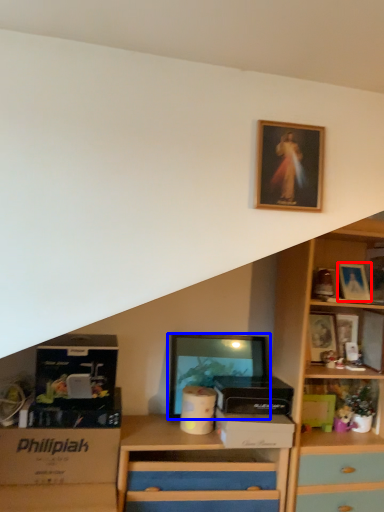
Question: Which point is further to the camera, picture frame (highlighted by a red box) or picture frame (highlighted by a blue box)?

Choices:
 (A) picture frame
 (B) picture frame

Answer: (A)